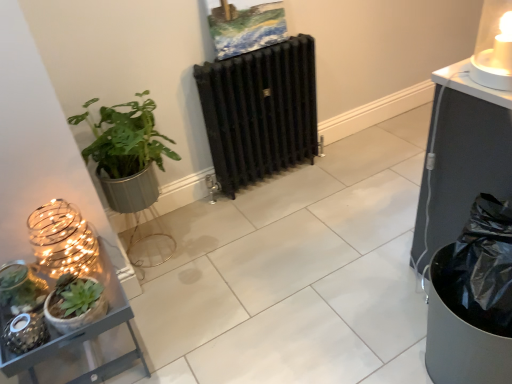
Question: Does black cast iron radiator at center have a smaller size compared to translucent glass candle at upper right, marked as the 2th candle holder in a bottom-to-top arrangement?

Choices:
 (A) no
 (B) yes

Answer: (A)

Question: Is translucent glass candle at upper right, marked as the 2th candle holder in a bottom-to-top arrangement, inside black cast iron radiator at center?

Choices:
 (A) no
 (B) yes

Answer: (A)

Question: From a real-world perspective, is black cast iron radiator at center physically above translucent glass candle at upper right, the second candle holder when ordered from left to right?

Choices:
 (A) yes
 (B) no

Answer: (B)

Question: Does black cast iron radiator at center have a lesser height compared to translucent glass candle at upper right, which is the first candle holder in right-to-left order?

Choices:
 (A) yes
 (B) no

Answer: (B)

Question: Considering the relative sizes of black cast iron radiator at center and translucent glass candle at upper right, which is the first candle holder in right-to-left order, in the image provided, is black cast iron radiator at center wider than translucent glass candle at upper right, which is the first candle holder in right-to-left order,?

Choices:
 (A) yes
 (B) no

Answer: (B)

Question: From their relative heights in the image, would you say green matte succulent at lower left, which is the 2th houseplant in back-to-front order, is taller or shorter than translucent glass candle at upper right, which appears as the 1th candle holder when viewed from the top?

Choices:
 (A) short
 (B) tall

Answer: (A)

Question: Is point (52, 322) positioned closer to the camera than point (480, 71)?

Choices:
 (A) closer
 (B) farther

Answer: (A)

Question: Looking at their shapes, would you say green matte succulent at lower left, placed as the first houseplant when sorted from front to back, is wider or thinner than translucent glass candle at upper right, which is the first candle holder in right-to-left order?

Choices:
 (A) wide
 (B) thin

Answer: (B)

Question: Choose the correct answer: Is green matte succulent at lower left, placed as the first houseplant when sorted from front to back, inside translucent glass candle at upper right, which is the first candle holder in right-to-left order, or outside it?

Choices:
 (A) inside
 (B) outside

Answer: (B)

Question: From their relative heights in the image, would you say green matte plant at left, the 1th houseplant when ordered from back to front, is taller or shorter than green matte succulent at lower left?

Choices:
 (A) tall
 (B) short

Answer: (A)

Question: Considering their positions, is green matte plant at left, which is counted as the 2th houseplant, starting from the front, located in front of or behind green matte succulent at lower left?

Choices:
 (A) behind
 (B) front

Answer: (A)

Question: From the image's perspective, relative to green matte succulent at lower left, is green matte plant at left, which is counted as the 2th houseplant, starting from the front, above or below?

Choices:
 (A) above
 (B) below

Answer: (A)

Question: From a real-world perspective, is green matte plant at left, which is counted as the 2th houseplant, starting from the front, physically located above or below green matte succulent at lower left?

Choices:
 (A) below
 (B) above

Answer: (A)

Question: From their relative heights in the image, would you say black cast iron radiator at center is taller or shorter than translucent glass candle at upper right, marked as the 2th candle holder in a bottom-to-top arrangement?

Choices:
 (A) tall
 (B) short

Answer: (A)

Question: Considering the positions of black cast iron radiator at center and translucent glass candle at upper right, the second candle holder when ordered from left to right, in the image, is black cast iron radiator at center bigger or smaller than translucent glass candle at upper right, the second candle holder when ordered from left to right,?

Choices:
 (A) big
 (B) small

Answer: (A)